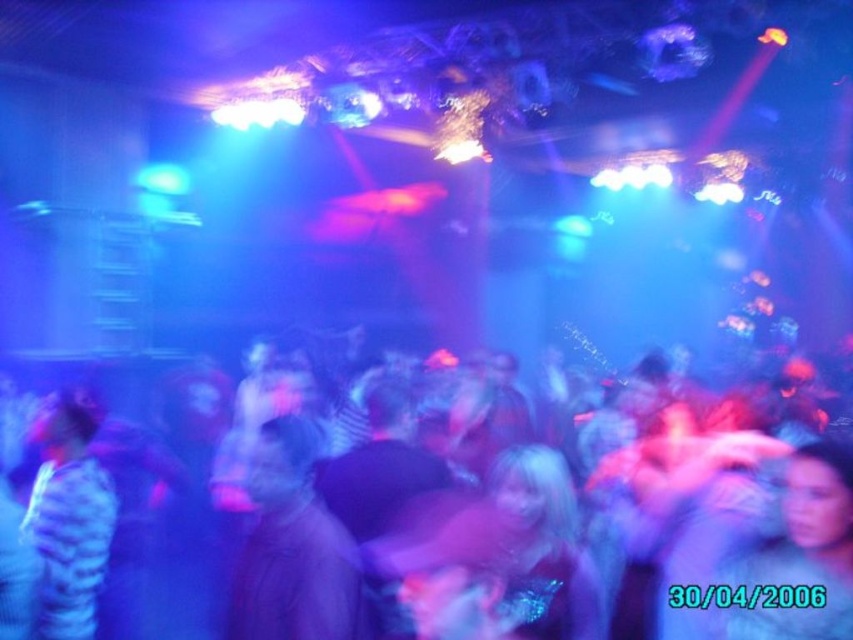
You are a photographer trying to capture a clear shot of the striped fabric shirt at left without including the blurred people at center. Based on the scene, which direction should you move your camera to achieve this?

The blurred people at center are to the right of the striped fabric shirt at left. To avoid including them in the shot, move your camera to the left side of the striped fabric shirt at left.

You are a photographer who wants to capture a clear shot of the striped fabric shirt at left without the blurred people at center blocking it. How can you adjust your camera settings to achieve this?

The blurred people at center are thinner than the striped fabric shirt at left. To avoid the blurred people at center blocking the striped fabric shirt at left, you can use a smaller aperture to increase depth of field, ensuring both objects are in focus.

Consider the image. You are a photographer standing at the origin point in the nightclub scene. You want to capture a clear shot of the blurred people at center. Which direction should you move to get closer to them?

The blurred people at center are located at point 0.906 on the x axis and 0.351 on the y axis. Since you are at the origin point, you should move towards the positive x and positive y direction to get closer to them.